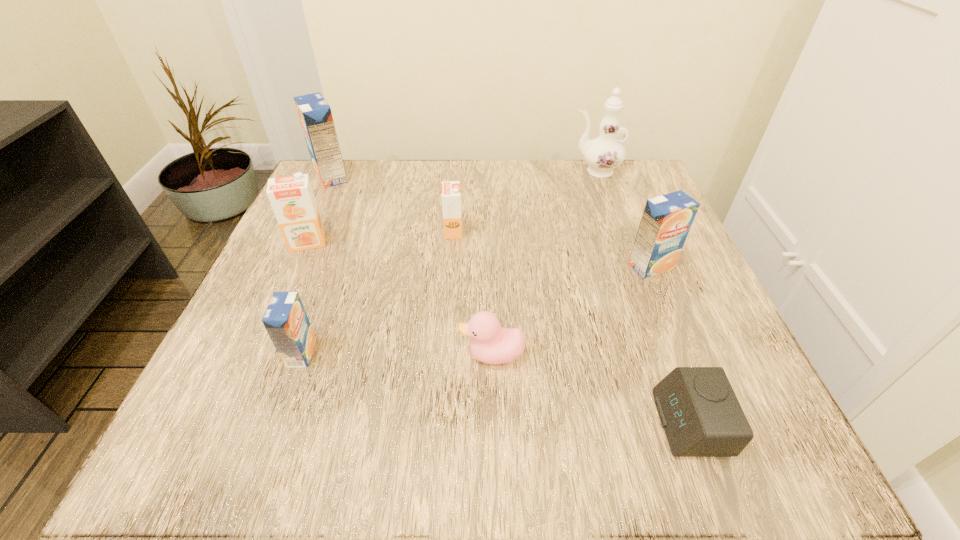
The height and width of the screenshot is (540, 960). In the image, there is a desktop. What are the coordinates of `free space at the right edge` in the screenshot? It's located at click(x=676, y=321).

Locate an element on the screen. free space at the far left corner of the desktop is located at coordinates (324, 211).

In the image, there is a desktop. Identify the location of vacant area at the near left corner. The image size is (960, 540). (242, 433).

In order to click on vacant position at the far right corner of the desktop in this screenshot , I will do `click(637, 202)`.

You are a GUI agent. You are given a task and a screenshot of the screen. Output one action in this format:
    pyautogui.click(x=<x>, y=<y>)
    Task: Click on the free area in between the second farthest blue orange_juice and the biggest blue orange_juice
    
    Given the screenshot: What is the action you would take?
    pyautogui.click(x=491, y=221)

Locate an element on the screen. vacant area that lies between the fourth farthest orange juice and the black alarm clock is located at coordinates (670, 345).

Where is `free space between the third orange juice from right to left and the duckling`? The image size is (960, 540). free space between the third orange juice from right to left and the duckling is located at coordinates click(x=396, y=354).

You are a GUI agent. You are given a task and a screenshot of the screen. Output one action in this format:
    pyautogui.click(x=<x>, y=<y>)
    Task: Click on the free area in between the black alarm clock and the smallest blue orange_juice
    The height and width of the screenshot is (540, 960).
    Given the screenshot: What is the action you would take?
    pyautogui.click(x=495, y=388)

Where is `free space between the smaller orange orange juice and the duckling`? This screenshot has width=960, height=540. free space between the smaller orange orange juice and the duckling is located at coordinates (472, 293).

You are a GUI agent. You are given a task and a screenshot of the screen. Output one action in this format:
    pyautogui.click(x=<x>, y=<y>)
    Task: Click on the unoccupied position between the bigger orange orange juice and the fourth object from right to left
    The image size is (960, 540).
    Given the screenshot: What is the action you would take?
    pyautogui.click(x=400, y=299)